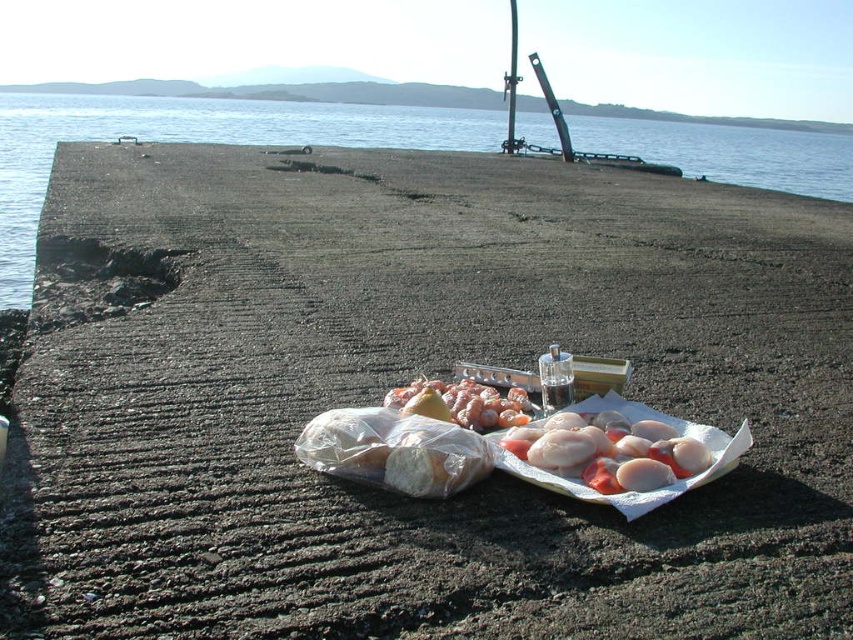
Question: Which point is farther to the camera?

Choices:
 (A) clear glass bottle at center
 (B) translucent plastic bag of grapes at center
 (C) transparent water at center
 (D) pinkish translucent scallops at center

Answer: (C)

Question: Which point is closer to the camera?

Choices:
 (A) (663, 156)
 (B) (459, 419)
 (C) (549, 365)

Answer: (B)

Question: Does pinkish translucent scallops at center have a smaller size compared to clear glass bottle at center?

Choices:
 (A) yes
 (B) no

Answer: (B)

Question: Does transparent water at center have a smaller size compared to pinkish translucent scallops at center?

Choices:
 (A) no
 (B) yes

Answer: (A)

Question: Considering the real-world distances, which object is farthest from the pinkish translucent scallops at center?

Choices:
 (A) translucent plastic bag of grapes at center
 (B) transparent water at center

Answer: (B)

Question: Can you confirm if pinkish translucent scallops at center is bigger than clear glass bottle at center?

Choices:
 (A) no
 (B) yes

Answer: (B)